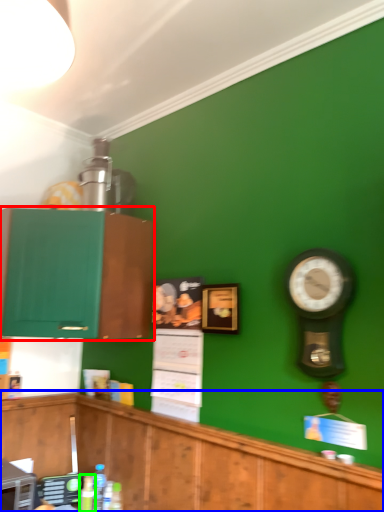
Question: Which object is positioned closest to cabinetry (highlighted by a red box)? Select from cabinetry (highlighted by a blue box) and bottle (highlighted by a green box).

Choices:
 (A) cabinetry
 (B) bottle

Answer: (A)